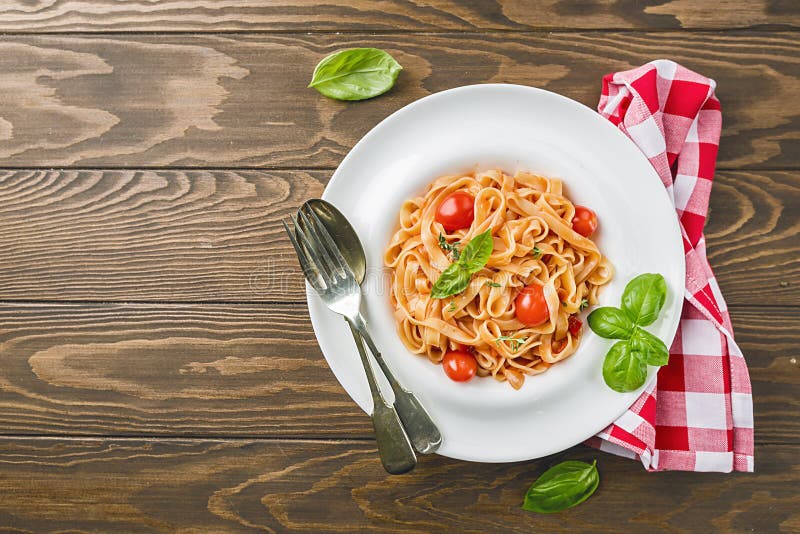
The height and width of the screenshot is (534, 800). Find the location of `fork`. fork is located at coordinates (341, 300).